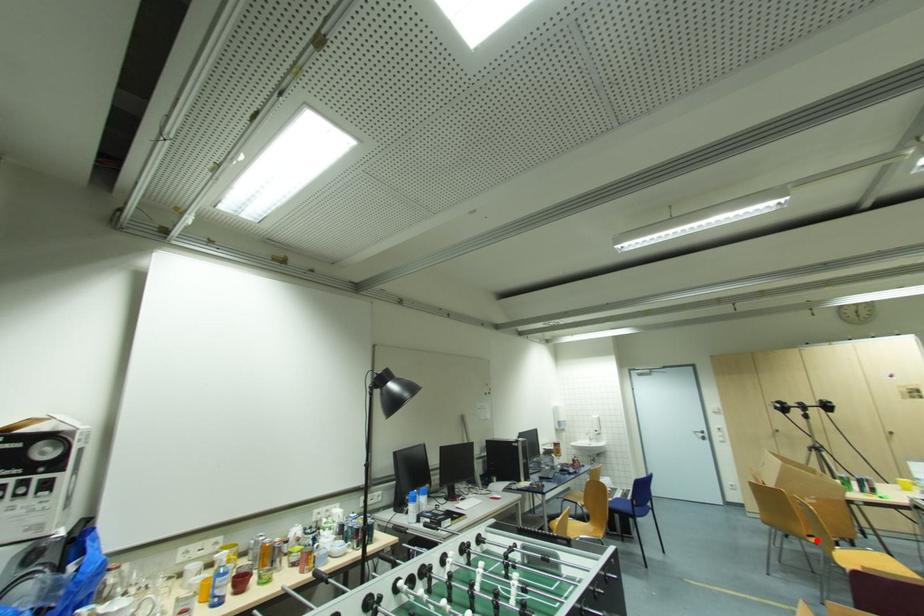
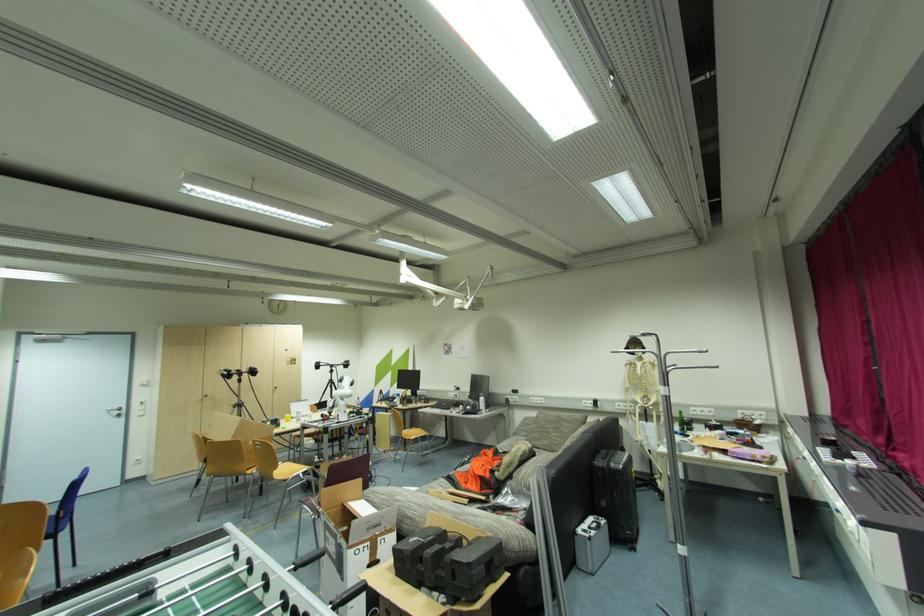
Question: I am providing you with two images of the same scene from different viewpoints. In image1, a red point is highlighted. Considering the same 3D point in image2, which of the following is correct?

Choices:
 (A) It is closer
 (B) It is farther

Answer: (A)